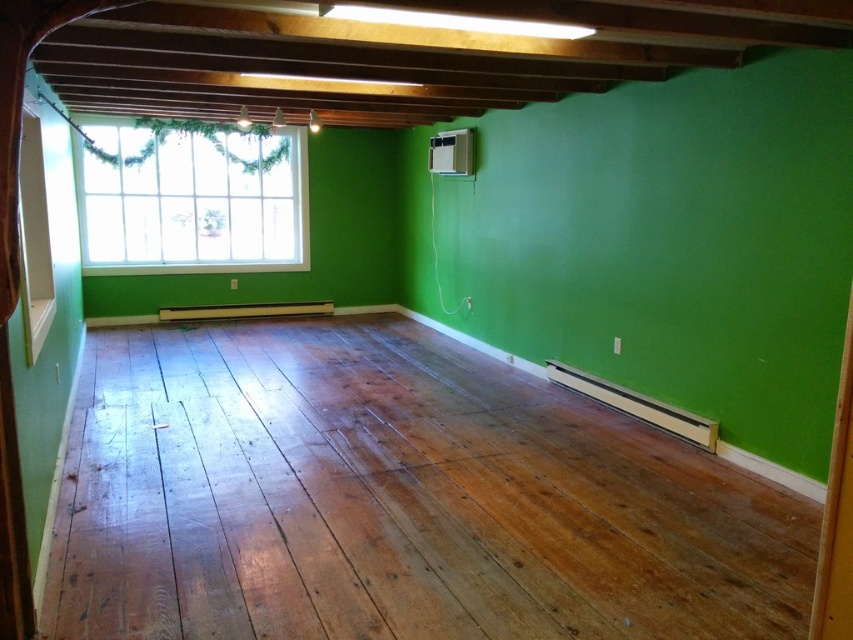
Question: Does shiny brown wood floor at center appear on the left side of clear glass window at upper left?

Choices:
 (A) yes
 (B) no

Answer: (B)

Question: Is shiny brown wood floor at center positioned before clear glass window at upper left?

Choices:
 (A) no
 (B) yes

Answer: (B)

Question: Is shiny brown wood floor at center above clear glass window at upper left?

Choices:
 (A) no
 (B) yes

Answer: (A)

Question: Which point appears farthest from the camera in this image?

Choices:
 (A) pyautogui.click(x=195, y=204)
 (B) pyautogui.click(x=659, y=531)

Answer: (A)